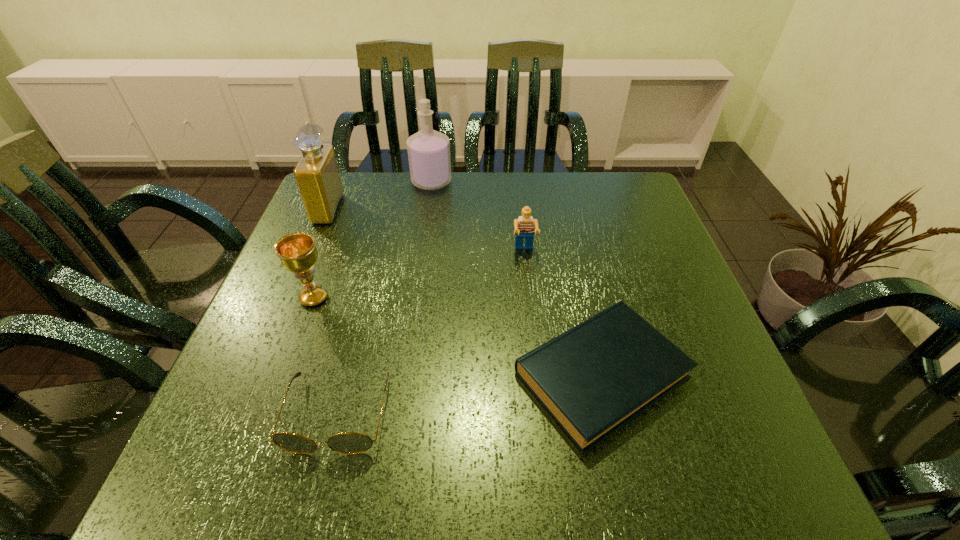
Locate an element on the screen. The height and width of the screenshot is (540, 960). the farther perfume is located at coordinates (428, 150).

The width and height of the screenshot is (960, 540). What are the coordinates of `the farthest object` in the screenshot? It's located at (428, 150).

Find the location of a particular element. The width and height of the screenshot is (960, 540). the fifth nearest object is located at coordinates [x=317, y=175].

Locate an element on the screen. the left perfume is located at coordinates [x=317, y=175].

This screenshot has height=540, width=960. I want to click on chalice, so click(x=297, y=252).

Image resolution: width=960 pixels, height=540 pixels. I want to click on the fourth shortest object, so click(x=297, y=252).

The height and width of the screenshot is (540, 960). I want to click on the fourth nearest object, so point(524,226).

The width and height of the screenshot is (960, 540). Identify the location of the third shortest object. click(524, 226).

At what (x,y) coordinates should I click in order to perform the action: click on the second shortest object. Please return your answer as a coordinate pair (x, y). Looking at the image, I should click on (348, 442).

Image resolution: width=960 pixels, height=540 pixels. Find the location of `the shortest object`. the shortest object is located at coordinates (593, 379).